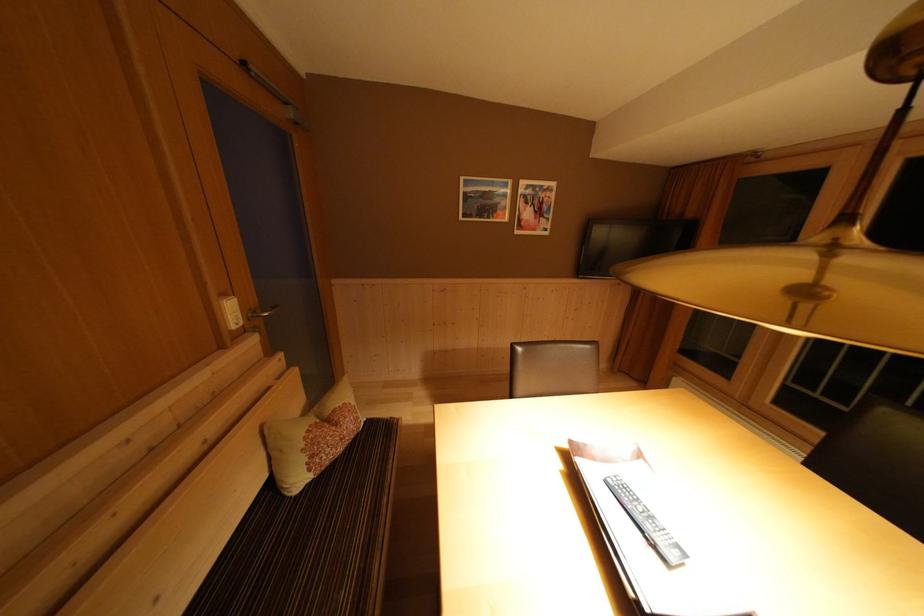
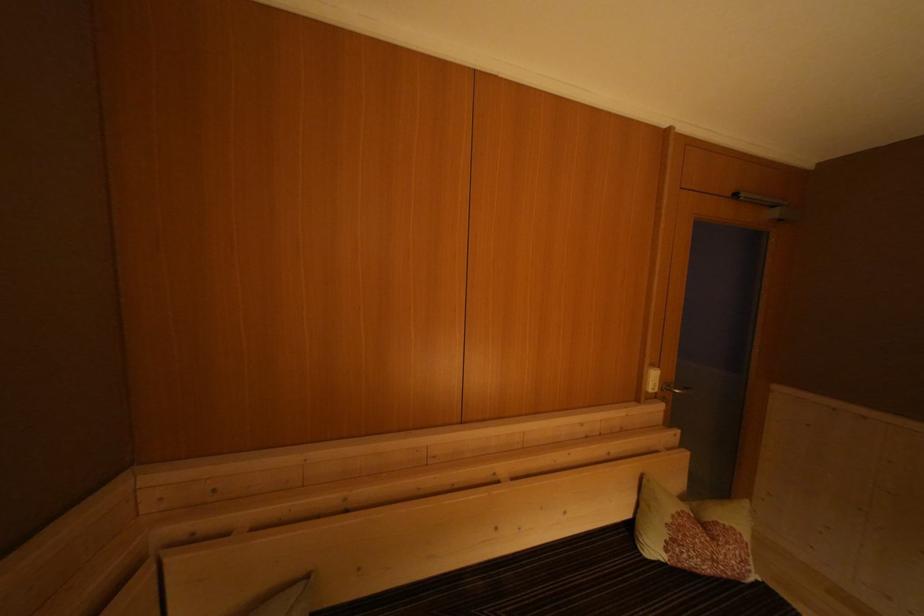
Question: Based on the continuous images, in which direction is the camera rotating? Reply with the corresponding letter.

Choices:
 (A) Left
 (B) Right
 (C) Up
 (D) Down

Answer: (A)